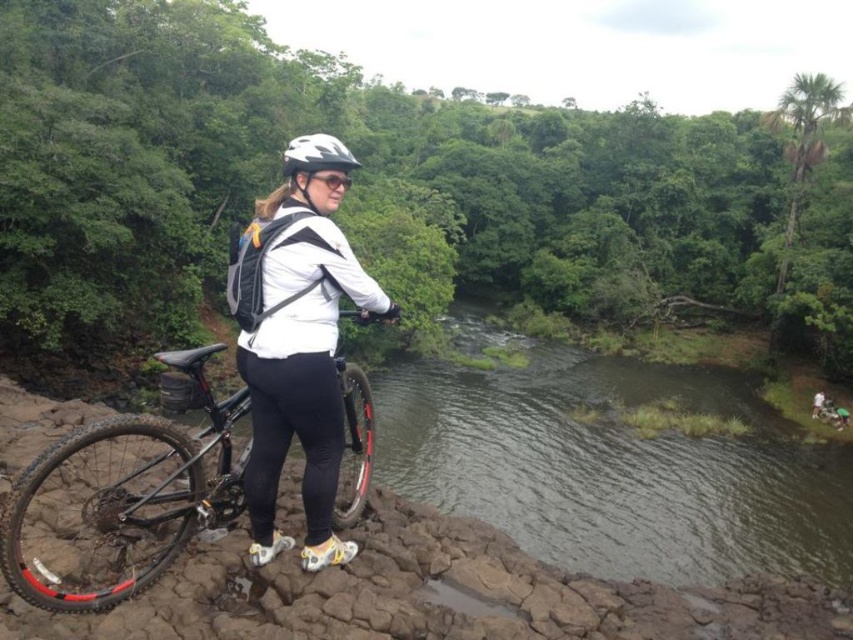
Question: Is white matte jacket at center smaller than white matte bicycle helmet at center?

Choices:
 (A) no
 (B) yes

Answer: (B)

Question: Which point is farther from the camera taking this photo?

Choices:
 (A) click(6, 522)
 (B) click(296, 145)
 (C) click(276, 264)

Answer: (B)

Question: Which object appears farthest from the camera in this image?

Choices:
 (A) black matte bicycle at center
 (B) white matte bicycle helmet at center
 (C) white matte jacket at center

Answer: (A)

Question: Estimate the real-world distances between objects in this image. Which object is farther from the white matte bicycle helmet at center?

Choices:
 (A) black matte bicycle at center
 (B) white matte jacket at center

Answer: (A)

Question: Does black matte bicycle at center appear over white matte bicycle helmet at center?

Choices:
 (A) no
 (B) yes

Answer: (A)

Question: Is white matte jacket at center thinner than black matte bicycle at center?

Choices:
 (A) no
 (B) yes

Answer: (A)